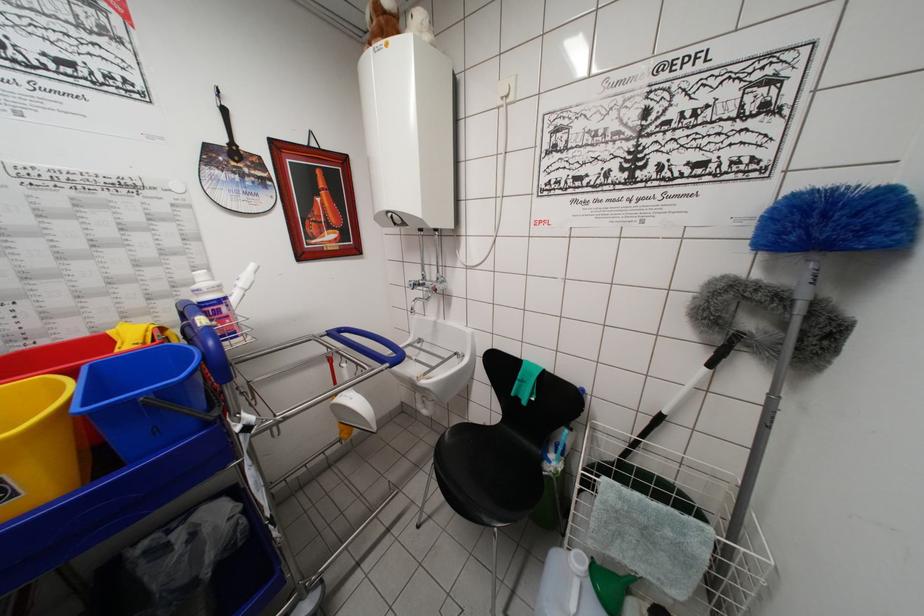
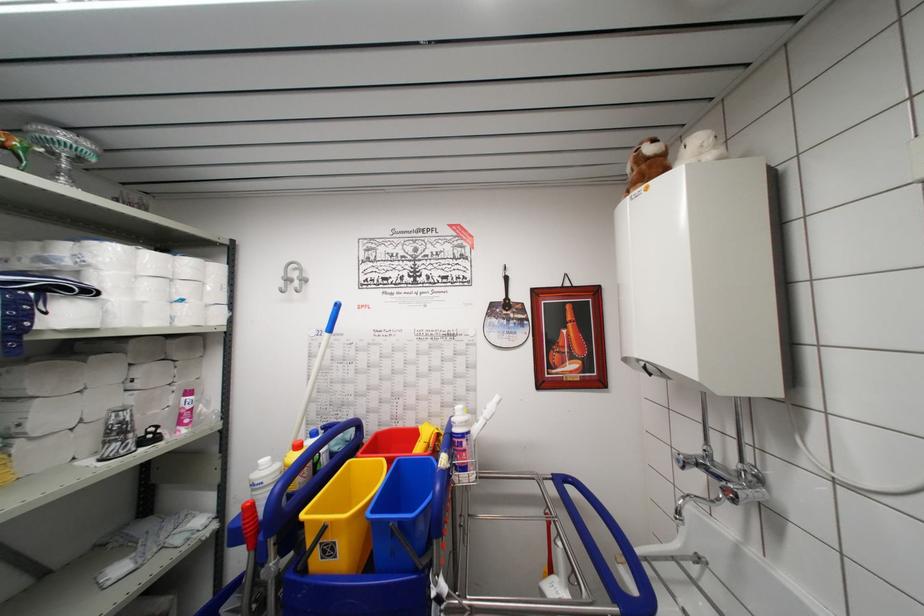
In the second image, find the point that corresponds to (215,315) in the first image.

(460, 447)